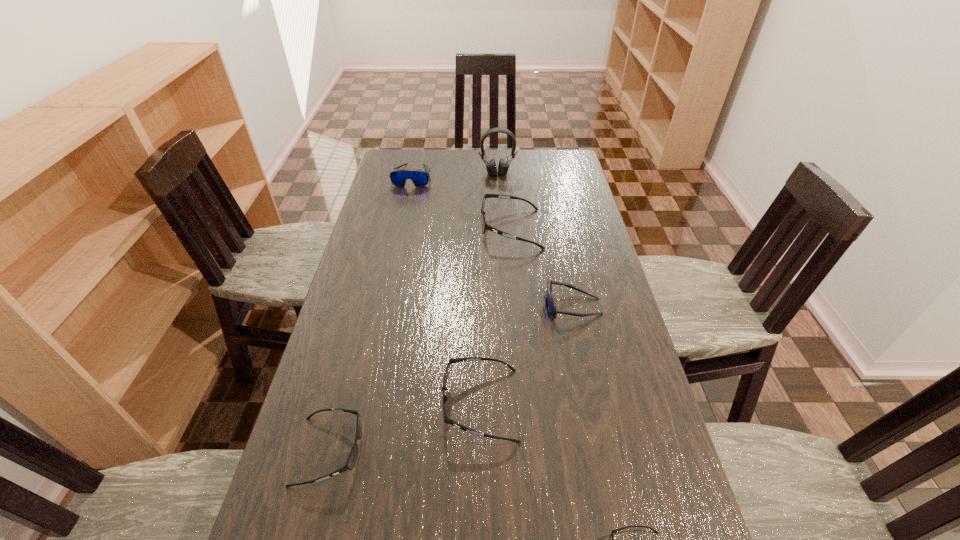
Locate an element on the screen. vacant region between the left blue sunglasses and the leftmost gray sunglasses is located at coordinates click(x=371, y=314).

Image resolution: width=960 pixels, height=540 pixels. Identify the location of free spot between the farthest gray sunglasses and the tallest object. (504, 201).

This screenshot has height=540, width=960. I want to click on free area in between the third farthest object and the nearer blue sunglasses, so click(541, 267).

At what (x,y) coordinates should I click in order to perform the action: click on blank region between the fourth nearest sunglasses and the left blue sunglasses. Please return your answer as a coordinate pair (x, y). Image resolution: width=960 pixels, height=540 pixels. Looking at the image, I should click on (492, 241).

Where is `vacant area between the tallest object and the fourth nearest object`? This screenshot has width=960, height=540. vacant area between the tallest object and the fourth nearest object is located at coordinates (535, 240).

Locate an element on the screen. object that is the fourth closest to the second biggest gray sunglasses is located at coordinates (484, 226).

Where is `object that is the sixth closest to the second biggest gray sunglasses`? object that is the sixth closest to the second biggest gray sunglasses is located at coordinates (503, 166).

Identify which sunglasses is the fourth nearest to the bigger blue sunglasses. Please provide its 2D coordinates. Your answer should be formatted as a tuple, i.e. [(x, y)], where the tuple contains the x and y coordinates of a point satisfying the conditions above.

[(351, 461)]

Point out which sunglasses is positioned as the third nearest to the biggest gray sunglasses. Please provide its 2D coordinates. Your answer should be formatted as a tuple, i.e. [(x, y)], where the tuple contains the x and y coordinates of a point satisfying the conditions above.

[(444, 398)]

Locate an element on the screen. gray sunglasses object that ranks as the closest to the second biggest gray sunglasses is located at coordinates (351, 461).